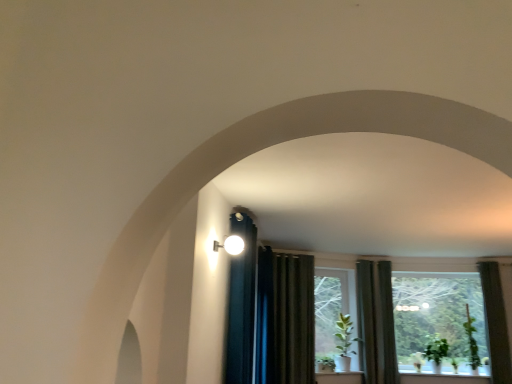
What do you see at coordinates (443, 368) in the screenshot? The height and width of the screenshot is (384, 512). I see `white ceramic window sill at lower center` at bounding box center [443, 368].

Image resolution: width=512 pixels, height=384 pixels. What do you see at coordinates (285, 318) in the screenshot?
I see `dark green velvet curtain at center, acting as the third curtain starting from the right` at bounding box center [285, 318].

Identify the location of transparent glass window at center. (439, 323).

What is the approximate height of green matte plant at center?

The height of green matte plant at center is 38.05 inches.

This screenshot has width=512, height=384. Find the location of `white ceramic window sill at lower center`. white ceramic window sill at lower center is located at coordinates (443, 368).

You are a GUI agent. You are given a task and a screenshot of the screen. Output one action in this format:
    pyautogui.click(x=<x>, y=<y>)
    Task: Click on the 2nd curtain to the left when counting from the green matte plant at lower right, which appears as the 2th plant when viewed from the right
    Image resolution: width=512 pixels, height=384 pixels.
    Given the screenshot: What is the action you would take?
    pyautogui.click(x=285, y=318)

From the image's perspective, is dark green velvet curtain at center, positioned as the 1th curtain in left-to-right order, located beneath green matte plant at lower right, which appears as the 2th plant when viewed from the right?

Actually, dark green velvet curtain at center, positioned as the 1th curtain in left-to-right order, appears above green matte plant at lower right, which appears as the 2th plant when viewed from the right, in the image.

Between dark green velvet curtain at center, acting as the third curtain starting from the right, and green matte plant at lower right, which appears as the 2th plant when viewed from the right, which one has more height?

Standing taller between the two is dark green velvet curtain at center, acting as the third curtain starting from the right.

Considering the relative sizes of dark green velvet curtain at center, positioned as the 1th curtain in left-to-right order, and green matte plant at lower right, which appears as the 2th plant when viewed from the right, in the image provided, is dark green velvet curtain at center, positioned as the 1th curtain in left-to-right order, wider than green matte plant at lower right, which appears as the 2th plant when viewed from the right,?

No, dark green velvet curtain at center, positioned as the 1th curtain in left-to-right order, is not wider than green matte plant at lower right, which appears as the 2th plant when viewed from the right.

From a real-world perspective, is transparent glass window at center located beneath matte white sconce at upper center?

Yes, from a real-world perspective, transparent glass window at center is below matte white sconce at upper center.

Which object is thinner, transparent glass window at center or matte white sconce at upper center?

With smaller width is transparent glass window at center.

Looking at this image, is transparent glass window at center not near matte white sconce at upper center?

Indeed, transparent glass window at center is not near matte white sconce at upper center.

In the scene shown: Is green matte plant at center at the left side of green matte plant at lower right, which appears as the 2th plant when viewed from the right?

Yes.

Does green matte plant at center lie behind green matte plant at lower right, which appears as the 2th plant when viewed from the right?

Yes, green matte plant at center is behind green matte plant at lower right, which appears as the 2th plant when viewed from the right.

Who is shorter, green matte plant at center or green matte plant at lower right, which appears as the 2th plant when viewed from the right?

Standing shorter between the two is green matte plant at lower right, which appears as the 2th plant when viewed from the right.

Is point (321, 323) positioned behind point (434, 351)?

No.

From the image's perspective, would you say matte white sconce at upper center is positioned over white ceramic window sill at lower center?

Yes.

Does point (242, 246) come farther from viewer compared to point (420, 363)?

No, (242, 246) is closer to viewer.

From a real-world perspective, is matte white sconce at upper center on top of white ceramic window sill at lower center?

Yes, from a real-world perspective, matte white sconce at upper center is over white ceramic window sill at lower center

Could you tell me if green leafy plant at right, the second plant in the left-to-right sequence, is facing white ceramic window sill at lower center?

No, green leafy plant at right, the second plant in the left-to-right sequence, does not turn towards white ceramic window sill at lower center.

Consider the image. From the image's perspective, is green leafy plant at right, which is the 1th plant in right-to-left order, below white ceramic window sill at lower center?

No, from the image's perspective, green leafy plant at right, which is the 1th plant in right-to-left order, is not beneath white ceramic window sill at lower center.

In order to click on window sill in front of the green leafy plant at right, which is the 1th plant in right-to-left order in this screenshot , I will do `click(443, 368)`.

What's the angular difference between green leafy plant at right, which is the 1th plant in right-to-left order, and green fabric curtain at right, the second curtain viewed from the left,'s facing directions?

There is a 1.63-degree angle between the facing directions of green leafy plant at right, which is the 1th plant in right-to-left order, and green fabric curtain at right, the second curtain viewed from the left.

Is green leafy plant at right, which is the 1th plant in right-to-left order, far away from green fabric curtain at right, the second curtain viewed from the left?

That's right, there is a large distance between green leafy plant at right, which is the 1th plant in right-to-left order, and green fabric curtain at right, the second curtain viewed from the left.

Between green leafy plant at right, which is the 1th plant in right-to-left order, and green fabric curtain at right, the second curtain viewed from the left, which one appears on the right side from the viewer's perspective?

From the viewer's perspective, green leafy plant at right, which is the 1th plant in right-to-left order, appears more on the right side.

Is green leafy plant at right, the second plant in the left-to-right sequence, turned away from green fabric curtain at right, the second curtain viewed from the left?

No.

From a real-world perspective, who is located lower, white ceramic window sill at lower center or transparent glass window at center?

white ceramic window sill at lower center, from a real-world perspective.

Is white ceramic window sill at lower center wider or thinner than transparent glass window at center?

white ceramic window sill at lower center is wider than transparent glass window at center.

From the picture: From the image's perspective, would you say white ceramic window sill at lower center is positioned over transparent glass window at center?

No, from the image's perspective, white ceramic window sill at lower center is not above transparent glass window at center.

From the image's perspective, starting from the dark green velvet curtain at center, acting as the third curtain starting from the right, which plant is the 2nd one below? Please provide its 2D coordinates.

[(436, 348)]

Locate an element on the screen. The height and width of the screenshot is (384, 512). window screen to the right of matte white sconce at upper center is located at coordinates (439, 323).

Considering their positions, is green fabric curtain at right, which is the second curtain in right-to-left order, positioned further to white ceramic window sill at lower center than transparent glass window at center?

Among the two, green fabric curtain at right, which is the second curtain in right-to-left order, is located further to white ceramic window sill at lower center.

Which object lies further to the anchor point transparent glass window at center, dark green fabric curtain at right, positioned as the 3th curtain in left-to-right order, or white ceramic window sill at lower center?

Based on the image, dark green fabric curtain at right, positioned as the 3th curtain in left-to-right order, appears to be further to transparent glass window at center.

Which object lies nearer to the anchor point green fabric curtain at right, the second curtain viewed from the left, green leafy plant at right, which is the 1th plant in right-to-left order, or green matte plant at center?

Based on the image, green matte plant at center appears to be nearer to green fabric curtain at right, the second curtain viewed from the left.

Estimate the real-world distances between objects in this image. Which object is further from white ceramic window sill at lower center, transparent glass window at center or green matte plant at center?

green matte plant at center lies further to white ceramic window sill at lower center than the other object.

Looking at the image, which one is located closer to green leafy plant at right, which is the 1th plant in right-to-left order, green matte plant at lower right, which is the first plant from left to right, or dark green fabric curtain at right, positioned as the 3th curtain in left-to-right order?

The object closer to green leafy plant at right, which is the 1th plant in right-to-left order, is green matte plant at lower right, which is the first plant from left to right.

Based on their spatial positions, is green fabric curtain at right, which is the second curtain in right-to-left order, or green matte plant at center closer to green matte plant at center?

The object closer to green matte plant at center is green matte plant at center.

Looking at the image, which one is located further to matte white sconce at upper center, green fabric curtain at right, which is the second curtain in right-to-left order, or green matte plant at center?

Among the two, green fabric curtain at right, which is the second curtain in right-to-left order, is located further to matte white sconce at upper center.

Looking at this image, from the image, which object appears to be nearer to dark green velvet curtain at center, positioned as the 1th curtain in left-to-right order, green matte plant at lower right, which is the first plant from left to right, or green matte plant at center?

green matte plant at center.

Identify the location of houseplant between green matte plant at center and transparent glass window at center. (344, 343).

Locate an element on the screen. The height and width of the screenshot is (384, 512). curtain between dark green velvet curtain at center, positioned as the 1th curtain in left-to-right order, and transparent glass window at center from left to right is located at coordinates (376, 322).

The height and width of the screenshot is (384, 512). What are the coordinates of `curtain situated between dark green velvet curtain at center, acting as the third curtain starting from the right, and green matte plant at lower right, which is the first plant from left to right, from left to right` in the screenshot? It's located at (376, 322).

Where is `window positioned between matte white sconce at upper center and transparent glass window at center from near to far`? This screenshot has width=512, height=384. window positioned between matte white sconce at upper center and transparent glass window at center from near to far is located at coordinates (329, 308).